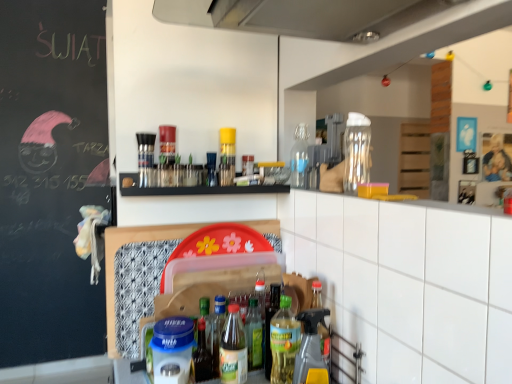
Question: Which direction should I rotate to face translucent plastic bottle at center, the tenth bottle from the right, — up or down?

Choices:
 (A) up
 (B) down

Answer: (B)

Question: Would you say transparent glass bottle at upper center, placed as the eleventh bottle when sorted from left to right, is a long distance from translucent plastic bottle at center, which is the second bottle in left-to-right order?

Choices:
 (A) no
 (B) yes

Answer: (A)

Question: Does transparent glass bottle at upper center, which is the first bottle in right-to-left order, turn towards translucent plastic bottle at center, the tenth bottle from the right?

Choices:
 (A) no
 (B) yes

Answer: (A)

Question: Is transparent glass bottle at upper center, placed as the eleventh bottle when sorted from left to right, smaller than translucent plastic bottle at center, which is the second bottle in left-to-right order?

Choices:
 (A) no
 (B) yes

Answer: (A)

Question: From the image's perspective, is transparent glass bottle at upper center, placed as the eleventh bottle when sorted from left to right, beneath translucent plastic bottle at center, the tenth bottle from the right?

Choices:
 (A) no
 (B) yes

Answer: (A)

Question: Can you confirm if transparent glass bottle at upper center, placed as the eleventh bottle when sorted from left to right, is positioned to the left of translucent plastic bottle at center, which is the second bottle in left-to-right order?

Choices:
 (A) yes
 (B) no

Answer: (B)

Question: Does transparent glass bottle at upper center, placed as the eleventh bottle when sorted from left to right, appear on the right side of translucent plastic bottle at center, the tenth bottle from the right?

Choices:
 (A) no
 (B) yes

Answer: (B)

Question: From the image's perspective, is transparent glass bottle at upper center, placed as the eleventh bottle when sorted from left to right, located above green glass bottle at center, the eighth bottle from the left?

Choices:
 (A) yes
 (B) no

Answer: (A)

Question: Does transparent glass bottle at upper center, placed as the eleventh bottle when sorted from left to right, have a greater height compared to green glass bottle at center, the eighth bottle from the left?

Choices:
 (A) yes
 (B) no

Answer: (B)

Question: Can you confirm if transparent glass bottle at upper center, placed as the eleventh bottle when sorted from left to right, is smaller than green glass bottle at center, the eighth bottle from the left?

Choices:
 (A) yes
 (B) no

Answer: (B)

Question: Is transparent glass bottle at upper center, placed as the eleventh bottle when sorted from left to right, to the left of green glass bottle at center, the eighth bottle from the left, from the viewer's perspective?

Choices:
 (A) no
 (B) yes

Answer: (A)

Question: Does transparent glass bottle at upper center, placed as the eleventh bottle when sorted from left to right, contain green glass bottle at center, the fourth bottle viewed from the right?

Choices:
 (A) no
 (B) yes

Answer: (A)

Question: Is transparent glass bottle at upper center, which is the first bottle in right-to-left order, thinner than green glass bottle at center, the fourth bottle viewed from the right?

Choices:
 (A) no
 (B) yes

Answer: (A)

Question: Considering the relative sizes of transparent glass bottle at upper center, which is the first bottle in right-to-left order, and translucent plastic bottle at center, arranged as the seventh bottle when viewed from the right, in the image provided, is transparent glass bottle at upper center, which is the first bottle in right-to-left order, taller than translucent plastic bottle at center, arranged as the seventh bottle when viewed from the right,?

Choices:
 (A) yes
 (B) no

Answer: (A)